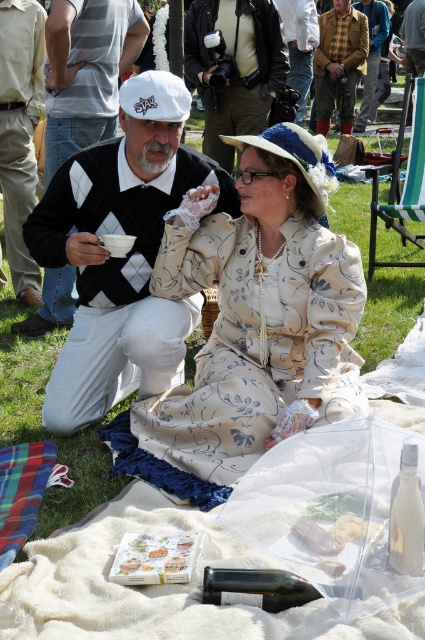
Is point (164, 138) farther from viewer compared to point (8, 32)?

No, (164, 138) is in front of (8, 32).

Based on the photo, is argyle sweater at center wider than khaki cotton pants at lower left?

Indeed, argyle sweater at center has a greater width compared to khaki cotton pants at lower left.

The height and width of the screenshot is (640, 425). I want to click on argyle sweater at center, so click(x=121, y=259).

Find the location of `argyle sweater at center`. argyle sweater at center is located at coordinates (121, 259).

Does white cotton picnic blanket at lower center have a lesser height compared to khaki cotton pants at lower left?

Yes.

Between white cotton picnic blanket at lower center and khaki cotton pants at lower left, which one appears on the left side from the viewer's perspective?

Positioned to the left is khaki cotton pants at lower left.

Who is more distant from viewer, (84, 618) or (14, 253)?

Point (14, 253)

This screenshot has width=425, height=640. Find the location of `white cotton picnic blanket at lower center`. white cotton picnic blanket at lower center is located at coordinates (159, 586).

Does white cotton picnic blanket at lower center appear under plaid wool jacket at center?

Indeed, white cotton picnic blanket at lower center is positioned under plaid wool jacket at center.

Does white cotton picnic blanket at lower center have a greater width compared to plaid wool jacket at center?

Yes, white cotton picnic blanket at lower center is wider than plaid wool jacket at center.

Which is behind, point (232, 614) or point (362, 42)?

The point (362, 42) is more distant.

At what (x,y) coordinates should I click in order to perform the action: click on white cotton picnic blanket at lower center. Please return your answer as a coordinate pair (x, y). This screenshot has width=425, height=640. Looking at the image, I should click on (159, 586).